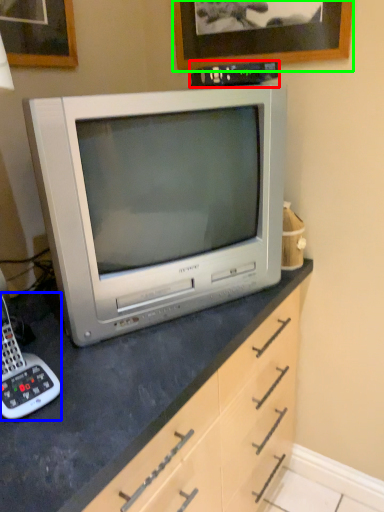
Question: Based on their relative distances, which object is farther from appliance (highlighted by a red box)? Choose from corded phone (highlighted by a blue box) and picture frame (highlighted by a green box).

Choices:
 (A) corded phone
 (B) picture frame

Answer: (A)